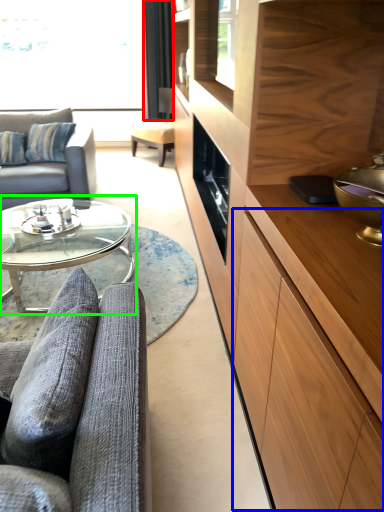
Question: Based on their relative distances, which object is nearer to curtain (highlighted by a red box)? Choose from drawer (highlighted by a blue box) and coffee table (highlighted by a green box).

Choices:
 (A) drawer
 (B) coffee table

Answer: (B)